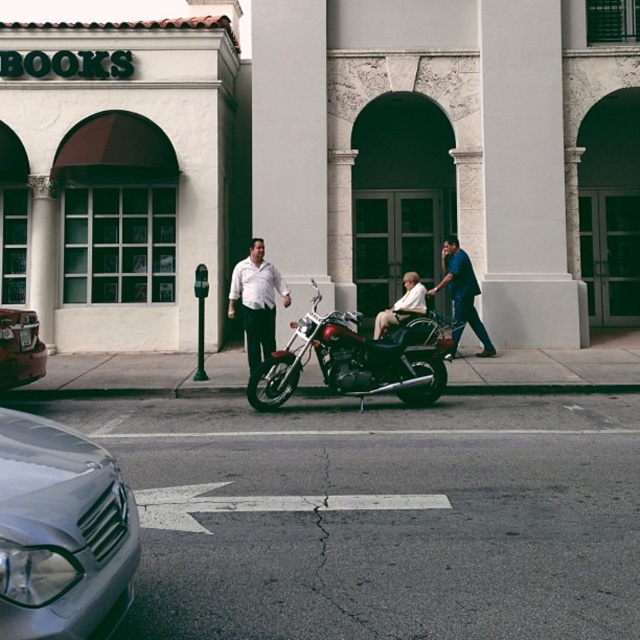
Question: Can you confirm if blue cotton shirt at center is bigger than smooth beige wheelchair at center?

Choices:
 (A) yes
 (B) no

Answer: (A)

Question: Is shiny chrome motorcycle at center bigger than smooth beige wheelchair at center?

Choices:
 (A) no
 (B) yes

Answer: (B)

Question: Is silver metallic car at lower left smaller than white matte shirt at center?

Choices:
 (A) no
 (B) yes

Answer: (B)

Question: Which of the following is the farthest from the observer?

Choices:
 (A) click(x=374, y=330)
 (B) click(x=451, y=337)
 (C) click(x=337, y=348)

Answer: (A)

Question: Which object is farther from the camera taking this photo?

Choices:
 (A) shiny silver car at lower left
 (B) silver metallic car at lower left
 (C) shiny chrome motorcycle at center

Answer: (C)

Question: Which point is closer to the camera?

Choices:
 (A) (429, 358)
 (B) (483, 339)
 (C) (244, 326)
 (D) (388, 316)

Answer: (A)